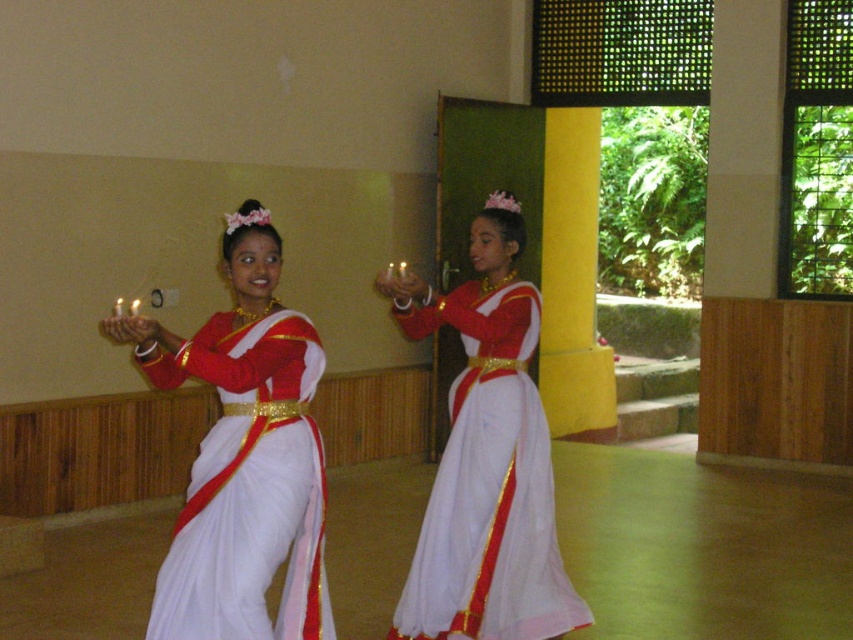
Two dancers are performing in a hall. They are standing at point [200,452]. How far apart are they?

The two dancers at point [200,452] are 11.43 feet apart.

Based on the photo, you are standing in the hall where the dance is taking place. You notice two points marked in the image. Which point, point 1 at coordinates [219,317] or point 2 at coordinates [541,426], is closer to you?

Point 1 at coordinates [219,317] is closer to you than point 2 at coordinates [541,426].